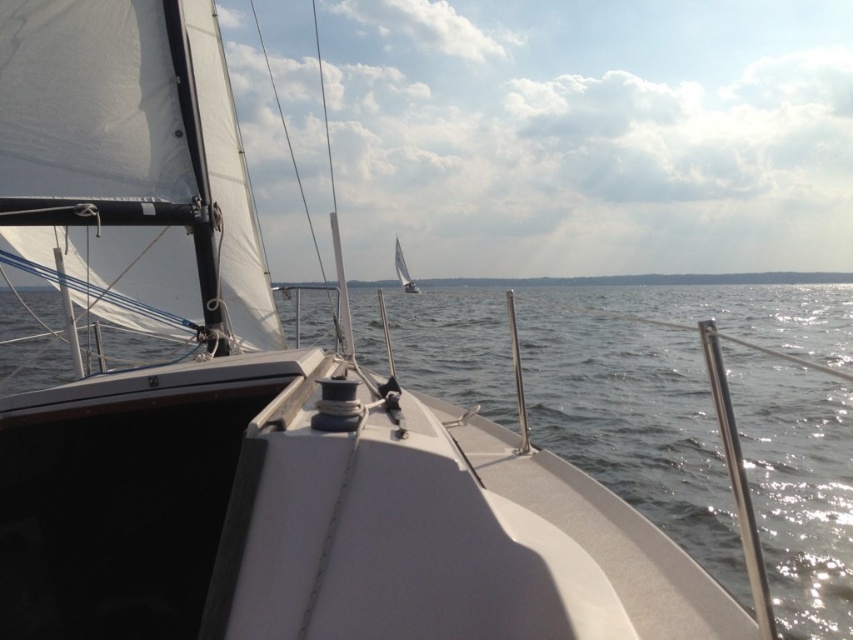
Does white cloud at upper center have a larger size compared to white sailboat at center?

Yes.

Between white cloud at upper center and white sailboat at center, which one is positioned lower?

white sailboat at center

Is point (772, 74) behind point (408, 282)?

Yes, point (772, 74) is behind point (408, 282).

Identify the location of white cloud at upper center. (590, 134).